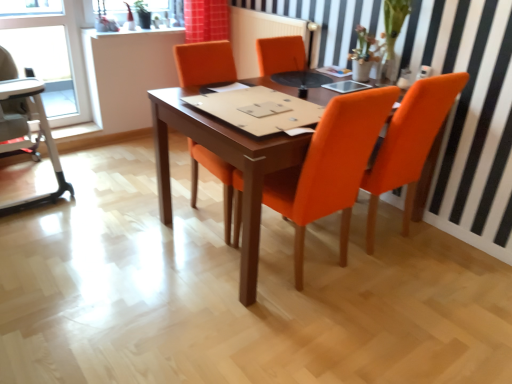
Question: Would you say orange fabric chair at center, positioned as the first chair in left-to-right order, is inside or outside transparent glass window at upper left?

Choices:
 (A) inside
 (B) outside

Answer: (B)

Question: Does point (187, 72) appear closer or farther from the camera than point (71, 74)?

Choices:
 (A) farther
 (B) closer

Answer: (B)

Question: Which object is positioned closest to the beige fabric high chair at left?

Choices:
 (A) wooden table at center
 (B) orange fabric chair at center, the second chair from the right
 (C) orange fabric chair at right, the 1th chair from the right
 (D) transparent glass window at upper left

Answer: (D)

Question: Which object is positioned closest to the wooden table at center?

Choices:
 (A) transparent glass window at upper left
 (B) orange fabric chair at center, the second chair from the right
 (C) beige fabric high chair at left
 (D) orange fabric chair at right, which is the 2th chair in left-to-right order

Answer: (B)